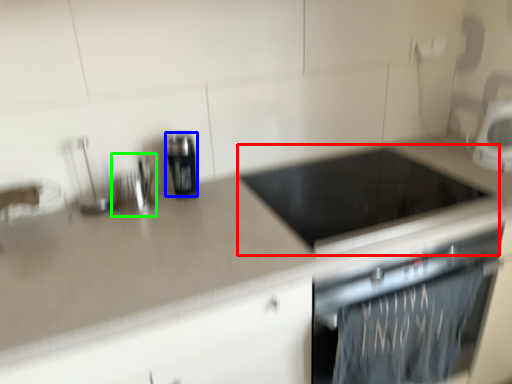
Question: Which is nearer to the appliance (highlighted by a red box)? kitchen appliance (highlighted by a blue box) or appliance (highlighted by a green box).

Choices:
 (A) kitchen appliance
 (B) appliance

Answer: (A)